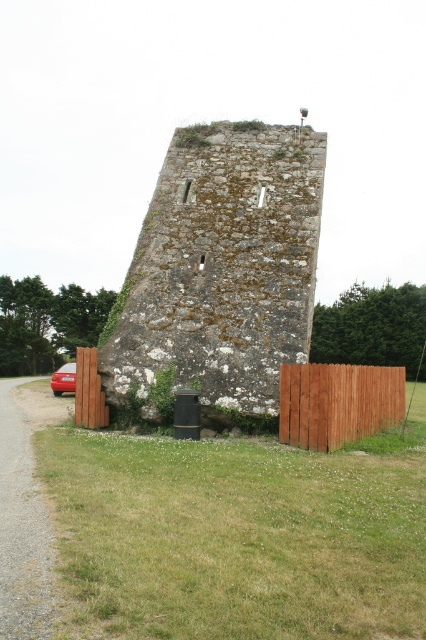
Who is higher up, rusty stone tower at center or shiny red sedan at left?

rusty stone tower at center is higher up.

Is rusty stone tower at center further to camera compared to shiny red sedan at left?

No.

Is point (210, 164) positioned before point (55, 372)?

Yes, point (210, 164) is closer to viewer.

The width and height of the screenshot is (426, 640). What are the coordinates of `rusty stone tower at center` in the screenshot? It's located at (221, 266).

Is brown wooden fence at lower left thinner than shiny red sedan at left?

Correct, brown wooden fence at lower left's width is less than shiny red sedan at left's.

Consider the image. Is brown wooden fence at lower left shorter than shiny red sedan at left?

Yes, brown wooden fence at lower left is shorter than shiny red sedan at left.

Is point (83, 394) more distant than point (72, 362)?

No, it is in front of (72, 362).

What are the coordinates of `brown wooden fence at lower left` in the screenshot? It's located at (89, 392).

Who is lower down, brown wooden fence at lower right or shiny red sedan at left?

shiny red sedan at left is lower down.

Locate an element on the screen. brown wooden fence at lower right is located at coordinates (337, 403).

Where is `brown wooden fence at lower right`? brown wooden fence at lower right is located at coordinates click(337, 403).